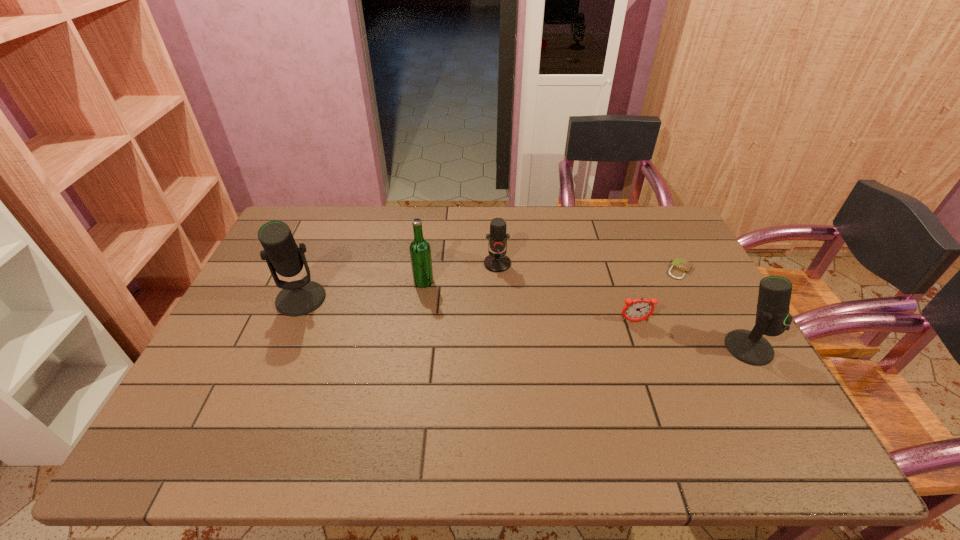
I want to click on unoccupied area between the fifth farthest object and the farthest microphone, so coord(566,293).

Locate an element on the screen. vacant space in between the fourth object from right to left and the nearest object is located at coordinates (623, 306).

Where is `free space between the second shortest microphone and the second nearest object`? The width and height of the screenshot is (960, 540). free space between the second shortest microphone and the second nearest object is located at coordinates (692, 334).

At what (x,y) coordinates should I click in order to perform the action: click on vacant area that lies between the nearest microphone and the second object from left to right. Please return your answer as a coordinate pair (x, y). The image size is (960, 540). Looking at the image, I should click on (587, 315).

Point out which object is positioned as the fifth nearest to the shortest microphone. Please provide its 2D coordinates. Your answer should be formatted as a tuple, i.e. [(x, y)], where the tuple contains the x and y coordinates of a point satisfying the conditions above.

[(772, 316)]

Select which object appears as the second closest to the second object from left to right. Please provide its 2D coordinates. Your answer should be formatted as a tuple, i.e. [(x, y)], where the tuple contains the x and y coordinates of a point satisfying the conditions above.

[(300, 297)]

The image size is (960, 540). What are the coordinates of `the second closest microphone relative to the alarm clock` in the screenshot? It's located at (496, 262).

Locate which microphone is the closest to the beer bottle. Please provide its 2D coordinates. Your answer should be formatted as a tuple, i.e. [(x, y)], where the tuple contains the x and y coordinates of a point satisfying the conditions above.

[(496, 262)]

The image size is (960, 540). What are the coordinates of `free location that satisfies the following two spatial constraints: 1. on the front-facing side of the second shortest object; 2. on the left side of the rightmost microphone` in the screenshot? It's located at (644, 348).

Locate an element on the screen. vacant region that satisfies the following two spatial constraints: 1. on the side of the fourth tallest object with the red ring; 2. on the right side of the shortest object is located at coordinates (497, 270).